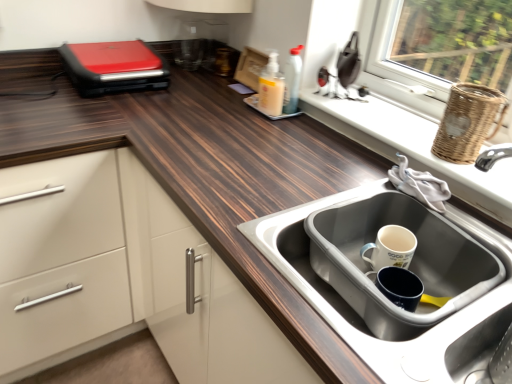
Identify the location of vacant space situated above white wicker basket at right (from a real-world perspective). This screenshot has height=384, width=512. (393, 118).